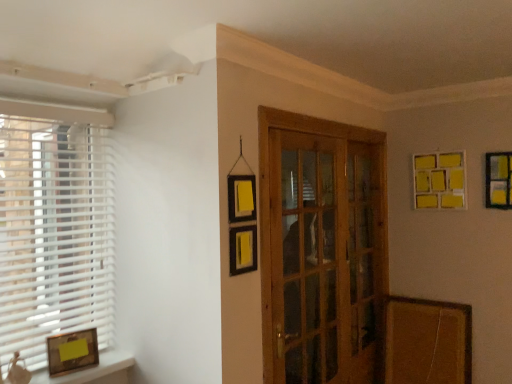
In order to face white plastic blinds at left, should I rotate leftwards or rightwards?

To face it directly, rotate left by 25.188 degrees.

I want to click on yellow matte picture frame at upper right, which is the 2th picture frame in right-to-left order, so click(439, 180).

Identify the location of matte gold picture frame at lower left, arranged as the third picture frame when viewed from the top. (72, 352).

How much space does matte gold picture frame at lower left, positioned as the first picture frame in left-to-right order, occupy vertically?

It is 7.58 inches.

You are a GUI agent. You are given a task and a screenshot of the screen. Output one action in this format:
    pyautogui.click(x=<x>, y=<y>)
    Task: Click on the wooden glass door at center
    
    Given the screenshot: What is the action you would take?
    pyautogui.click(x=322, y=249)

Measure the distance between point (298, 220) and camera.

The depth of point (298, 220) is 7.38 feet.

The height and width of the screenshot is (384, 512). What are the coordinates of `yellow matte picture frame at upper right, the 2th picture frame when ordered from back to front` in the screenshot? It's located at (498, 180).

This screenshot has height=384, width=512. I want to click on white plastic blinds at left, so (x=54, y=226).

How distant is white plastic blinds at left from yellow matte picture frame at upper right, which is counted as the third picture frame, starting from the bottom?

white plastic blinds at left is 2.18 meters away from yellow matte picture frame at upper right, which is counted as the third picture frame, starting from the bottom.

This screenshot has height=384, width=512. In order to click on the 2nd picture frame above when counting from the white plastic blinds at left (from the image's perspective) in this screenshot , I will do `click(439, 180)`.

Is white plastic blinds at left oriented towards yellow matte picture frame at upper right, which is the third picture frame from front to back?

No.

What's the angular difference between white plastic blinds at left and yellow matte picture frame at upper right, positioned as the 2th picture frame in left-to-right order,'s facing directions?

88.5 degrees.

Is white plastic blinds at left bigger than wooden glass door at center?

Actually, white plastic blinds at left might be smaller than wooden glass door at center.

Would you say white plastic blinds at left is a long distance from wooden glass door at center?

Yes.

This screenshot has width=512, height=384. I want to click on window on the left of wooden glass door at center, so click(54, 226).

Which object is more forward, matte gold picture frame at lower left, marked as the 1th picture frame in a bottom-to-top arrangement, or yellow matte picture frame at upper right, positioned as the 1th picture frame in top-to-bottom order?

matte gold picture frame at lower left, marked as the 1th picture frame in a bottom-to-top arrangement, is more forward.

Considering the sizes of objects matte gold picture frame at lower left, positioned as the first picture frame in left-to-right order, and yellow matte picture frame at upper right, positioned as the 1th picture frame in top-to-bottom order, in the image provided, who is smaller, matte gold picture frame at lower left, positioned as the first picture frame in left-to-right order, or yellow matte picture frame at upper right, positioned as the 1th picture frame in top-to-bottom order,?

matte gold picture frame at lower left, positioned as the first picture frame in left-to-right order, is smaller.

In the image, is matte gold picture frame at lower left, arranged as the third picture frame when viewed from the top, on the left side or the right side of yellow matte picture frame at upper right, positioned as the 2th picture frame in left-to-right order?

From the image, it's evident that matte gold picture frame at lower left, arranged as the third picture frame when viewed from the top, is to the left of yellow matte picture frame at upper right, positioned as the 2th picture frame in left-to-right order.

From a real-world perspective, which object rests below the other?

matte gold picture frame at lower left, arranged as the third picture frame when viewed from the top, is physically lower.

Considering the relative sizes of wooden glass door at center and white plastic blinds at left in the image provided, is wooden glass door at center wider than white plastic blinds at left?

Indeed, wooden glass door at center has a greater width compared to white plastic blinds at left.

You are a GUI agent. You are given a task and a screenshot of the screen. Output one action in this format:
    pyautogui.click(x=<x>, y=<y>)
    Task: Click on the window above the wooden glass door at center (from a real-world perspective)
    
    Given the screenshot: What is the action you would take?
    pyautogui.click(x=54, y=226)

Which object is more forward, wooden glass door at center or white plastic blinds at left?

white plastic blinds at left is closer to the camera.

Is yellow matte picture frame at upper right, marked as the 2th picture frame in a bottom-to-top arrangement, at the right side of yellow matte picture frame at upper right, which is counted as the third picture frame, starting from the bottom?

Yes, yellow matte picture frame at upper right, marked as the 2th picture frame in a bottom-to-top arrangement, is to the right of yellow matte picture frame at upper right, which is counted as the third picture frame, starting from the bottom.

Is yellow matte picture frame at upper right, marked as the 2th picture frame in a bottom-to-top arrangement, taller than yellow matte picture frame at upper right, which is counted as the third picture frame, starting from the bottom?

No.

How much distance is there between yellow matte picture frame at upper right, the 2th picture frame when ordered from back to front, and yellow matte picture frame at upper right, which appears as the first picture frame when viewed from the back?

yellow matte picture frame at upper right, the 2th picture frame when ordered from back to front, is 10.42 inches from yellow matte picture frame at upper right, which appears as the first picture frame when viewed from the back.

Is yellow matte picture frame at upper right, which ranks as the first picture frame in right-to-left order, placed right next to yellow matte picture frame at upper right, positioned as the 2th picture frame in left-to-right order?

There is a gap between yellow matte picture frame at upper right, which ranks as the first picture frame in right-to-left order, and yellow matte picture frame at upper right, positioned as the 2th picture frame in left-to-right order.

Which of these two, yellow matte picture frame at upper right, which ranks as the second picture frame in front-to-back order, or white plastic blinds at left, is smaller?

Smaller between the two is yellow matte picture frame at upper right, which ranks as the second picture frame in front-to-back order.

Which object is positioned more to the left, yellow matte picture frame at upper right, which ranks as the first picture frame in right-to-left order, or white plastic blinds at left?

white plastic blinds at left is more to the left.

From the image's perspective, would you say yellow matte picture frame at upper right, placed as the 3th picture frame when sorted from left to right, is shown under white plastic blinds at left?

No, from the image's perspective, yellow matte picture frame at upper right, placed as the 3th picture frame when sorted from left to right, is not below white plastic blinds at left.

From a real-world perspective, is yellow matte picture frame at upper right, placed as the 3th picture frame when sorted from left to right, positioned above or below white plastic blinds at left?

Clearly, from a real-world perspective, yellow matte picture frame at upper right, placed as the 3th picture frame when sorted from left to right, is above white plastic blinds at left.

Considering the points (289, 227) and (492, 179), which point is in front, point (289, 227) or point (492, 179)?

The point (289, 227) is more forward.

This screenshot has height=384, width=512. What are the coordinates of `the 1st picture frame located above the wooden glass door at center (from a real-world perspective)` in the screenshot? It's located at (498, 180).

Is wooden glass door at center inside the boundaries of yellow matte picture frame at upper right, marked as the 2th picture frame in a bottom-to-top arrangement, or outside?

wooden glass door at center is not inside yellow matte picture frame at upper right, marked as the 2th picture frame in a bottom-to-top arrangement, it's outside.

The width and height of the screenshot is (512, 384). In order to click on window directly beneath the yellow matte picture frame at upper right, which appears as the first picture frame when viewed from the back (from a real-world perspective) in this screenshot , I will do `click(54, 226)`.

Locate an element on the screen. door below the white plastic blinds at left (from the image's perspective) is located at coordinates (322, 249).

Based on their spatial positions, is matte gold picture frame at lower left, arranged as the 3th picture frame when viewed from the back, or white plastic blinds at left further from wooden glass door at center?

Based on the image, matte gold picture frame at lower left, arranged as the 3th picture frame when viewed from the back, appears to be further to wooden glass door at center.

Which object lies further to the anchor point wooden glass door at center, white plastic blinds at left or matte gold picture frame at lower left, positioned as the first picture frame in left-to-right order?

matte gold picture frame at lower left, positioned as the first picture frame in left-to-right order, is positioned further to the anchor wooden glass door at center.

Based on their spatial positions, is yellow matte picture frame at upper right, which appears as the first picture frame when viewed from the back, or white plastic blinds at left closer to yellow matte picture frame at upper right, acting as the 2th picture frame starting from the top?

yellow matte picture frame at upper right, which appears as the first picture frame when viewed from the back, lies closer to yellow matte picture frame at upper right, acting as the 2th picture frame starting from the top, than the other object.

When comparing their distances from matte gold picture frame at lower left, arranged as the third picture frame when viewed from the top, does white plastic blinds at left or yellow matte picture frame at upper right, which is the 2th picture frame in right-to-left order, seem closer?

white plastic blinds at left lies closer to matte gold picture frame at lower left, arranged as the third picture frame when viewed from the top, than the other object.

Estimate the real-world distances between objects in this image. Which object is further from yellow matte picture frame at upper right, acting as the 2th picture frame starting from the top, yellow matte picture frame at upper right, positioned as the 2th picture frame in left-to-right order, or matte gold picture frame at lower left, positioned as the first picture frame in left-to-right order?

matte gold picture frame at lower left, positioned as the first picture frame in left-to-right order, is further to yellow matte picture frame at upper right, acting as the 2th picture frame starting from the top.

Looking at this image, considering their positions, is matte gold picture frame at lower left, which is counted as the third picture frame, starting from the right, positioned closer to wooden glass door at center than yellow matte picture frame at upper right, the 2th picture frame when ordered from back to front?

yellow matte picture frame at upper right, the 2th picture frame when ordered from back to front.

From the image, which object appears to be farther from yellow matte picture frame at upper right, which is counted as the third picture frame, starting from the bottom, yellow matte picture frame at upper right, marked as the 2th picture frame in a bottom-to-top arrangement, or matte gold picture frame at lower left, arranged as the 3th picture frame when viewed from the back?

Among the two, matte gold picture frame at lower left, arranged as the 3th picture frame when viewed from the back, is located further to yellow matte picture frame at upper right, which is counted as the third picture frame, starting from the bottom.

Looking at the image, which one is located closer to white plastic blinds at left, yellow matte picture frame at upper right, which is counted as the third picture frame, starting from the bottom, or yellow matte picture frame at upper right, acting as the 2th picture frame starting from the top?

Based on the image, yellow matte picture frame at upper right, which is counted as the third picture frame, starting from the bottom, appears to be nearer to white plastic blinds at left.

The width and height of the screenshot is (512, 384). In order to click on door between matte gold picture frame at lower left, positioned as the first picture frame in left-to-right order, and yellow matte picture frame at upper right, acting as the 2th picture frame starting from the top, from left to right in this screenshot , I will do `click(322, 249)`.

The height and width of the screenshot is (384, 512). I want to click on door situated between white plastic blinds at left and yellow matte picture frame at upper right, which ranks as the second picture frame in front-to-back order, from left to right, so click(322, 249).

At what (x,y) coordinates should I click in order to perform the action: click on door located between white plastic blinds at left and yellow matte picture frame at upper right, positioned as the 1th picture frame in top-to-bottom order, in the left-right direction. Please return your answer as a coordinate pair (x, y). Looking at the image, I should click on (322, 249).

I want to click on picture frame between white plastic blinds at left and yellow matte picture frame at upper right, which is the third picture frame from front to back, from left to right, so click(72, 352).